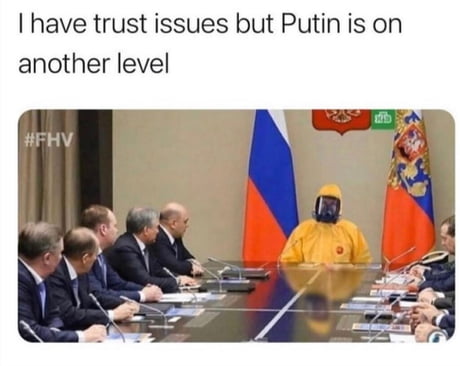
Locate an element on the screen. The height and width of the screenshot is (366, 460). drapes is located at coordinates (51, 179).